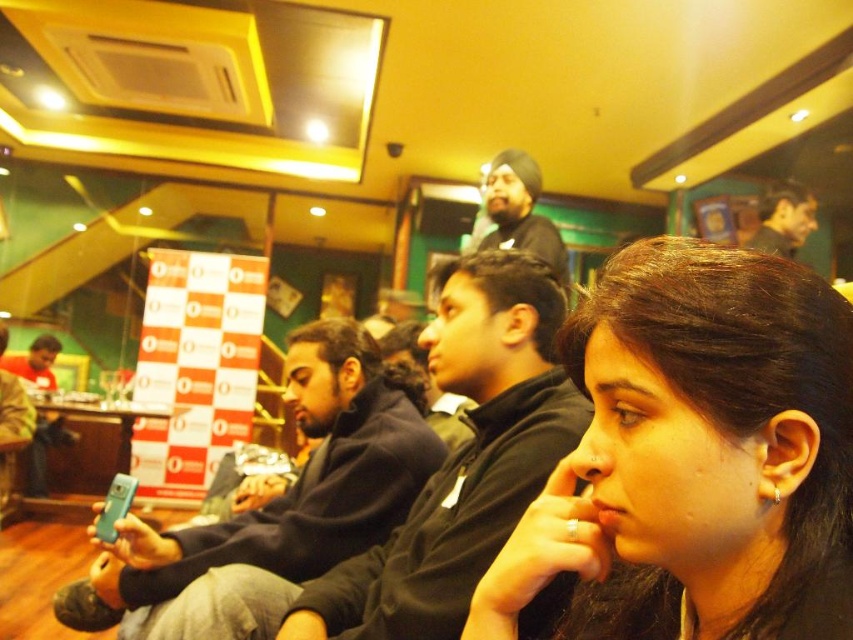
Is dark blue sweater at center shorter than matte blue phone at center?

Correct, dark blue sweater at center is not as tall as matte blue phone at center.

Which is more to the right, dark blue sweater at center or matte blue phone at center?

dark blue sweater at center is more to the right.

Does point (549, 291) come behind point (346, 406)?

No, (549, 291) is closer to viewer.

Find the location of a particular element. dark blue sweater at center is located at coordinates (463, 460).

Which is more to the right, dark brown hair at center or matte black turban at upper center?

From the viewer's perspective, matte black turban at upper center appears more on the right side.

Is dark brown hair at center positioned behind matte black turban at upper center?

That is False.

Does point (677, 268) come closer to viewer compared to point (753, 241)?

Yes, it is in front of point (753, 241).

Identify the location of dark brown hair at center. The height and width of the screenshot is (640, 853). (695, 456).

Who is positioned more to the right, matte blue phone at center or dark blue sweater at upper center?

From the viewer's perspective, dark blue sweater at upper center appears more on the right side.

Is point (253, 532) positioned before point (527, 205)?

Yes, it is.

The image size is (853, 640). In order to click on matte blue phone at center in this screenshot , I will do `click(292, 484)`.